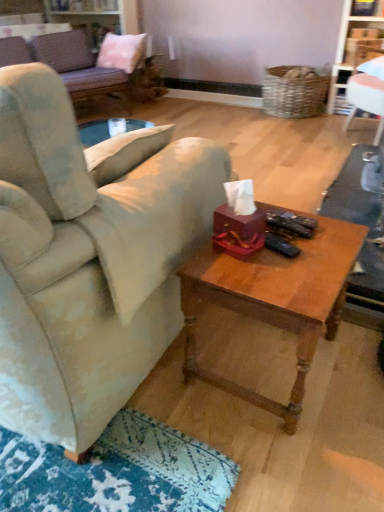
What is the approximate width of white glossy bookshelf at upper right?

It is 53.72 centimeters.

The width and height of the screenshot is (384, 512). Describe the element at coordinates (66, 62) in the screenshot. I see `velvet purple studio couch at upper left, acting as the first studio couch starting from the back` at that location.

The width and height of the screenshot is (384, 512). Describe the element at coordinates (273, 300) in the screenshot. I see `wooden coffee table at center` at that location.

What is the approximate width of velvet beige couch at center, the second studio couch when ordered from top to bottom?

4.13 feet.

The height and width of the screenshot is (512, 384). What do you see at coordinates (88, 260) in the screenshot?
I see `velvet beige couch at center, the second studio couch when ordered from top to bottom` at bounding box center [88, 260].

The height and width of the screenshot is (512, 384). What do you see at coordinates (121, 51) in the screenshot? I see `pink fabric pillow at upper left` at bounding box center [121, 51].

Identify the location of white glossy bookshelf at upper right. click(x=355, y=47).

Is wooden coffee table at center positioned far away from velvet purple studio couch at upper left, acting as the first studio couch starting from the back?

Indeed, wooden coffee table at center is not near velvet purple studio couch at upper left, acting as the first studio couch starting from the back.

Image resolution: width=384 pixels, height=512 pixels. In order to click on coffee table in front of the velvet purple studio couch at upper left, the 1th studio couch viewed from the top in this screenshot , I will do `click(273, 300)`.

Can you confirm if wooden coffee table at center is wider than velvet purple studio couch at upper left, arranged as the second studio couch when ordered from the bottom?

Incorrect, the width of wooden coffee table at center does not surpass that of velvet purple studio couch at upper left, arranged as the second studio couch when ordered from the bottom.

Is velvet purple studio couch at upper left, arranged as the second studio couch when ordered from the bottom, thinner than velvet beige couch at center, which is counted as the first studio couch, starting from the front?

Yes, velvet purple studio couch at upper left, arranged as the second studio couch when ordered from the bottom, is thinner than velvet beige couch at center, which is counted as the first studio couch, starting from the front.

Could you tell me if velvet purple studio couch at upper left, arranged as the second studio couch when ordered from the bottom, is turned towards velvet beige couch at center, positioned as the 2th studio couch in back-to-front order?

Yes, velvet purple studio couch at upper left, arranged as the second studio couch when ordered from the bottom, is oriented towards velvet beige couch at center, positioned as the 2th studio couch in back-to-front order.

Looking at this image, does velvet purple studio couch at upper left, the 1th studio couch viewed from the top, come behind velvet beige couch at center, which is counted as the first studio couch, starting from the front?

Yes, velvet purple studio couch at upper left, the 1th studio couch viewed from the top, is further from the viewer.

What's the angular difference between velvet purple studio couch at upper left, arranged as the second studio couch when viewed from the front, and white glossy bookshelf at upper right's facing directions?

velvet purple studio couch at upper left, arranged as the second studio couch when viewed from the front, and white glossy bookshelf at upper right are facing 118 degrees away from each other.

Which object is positioned more to the left, velvet purple studio couch at upper left, arranged as the second studio couch when ordered from the bottom, or white glossy bookshelf at upper right?

From the viewer's perspective, velvet purple studio couch at upper left, arranged as the second studio couch when ordered from the bottom, appears more on the left side.

Would you say velvet purple studio couch at upper left, acting as the first studio couch starting from the back, contains white glossy bookshelf at upper right?

No.

From the image's perspective, does velvet purple studio couch at upper left, arranged as the second studio couch when viewed from the front, appear higher than white glossy bookshelf at upper right?

Yes, from the image's perspective, velvet purple studio couch at upper left, arranged as the second studio couch when viewed from the front, is above white glossy bookshelf at upper right.

Can you confirm if velvet beige couch at center, the second studio couch when ordered from top to bottom, is positioned to the left of wooden coffee table at center?

Correct, you'll find velvet beige couch at center, the second studio couch when ordered from top to bottom, to the left of wooden coffee table at center.

Looking at this image, between velvet beige couch at center, the second studio couch when ordered from top to bottom, and wooden coffee table at center, which one has smaller width?

With smaller width is wooden coffee table at center.

Are velvet beige couch at center, which is counted as the first studio couch, starting from the front, and wooden coffee table at center far apart?

No, there isn't a large distance between velvet beige couch at center, which is counted as the first studio couch, starting from the front, and wooden coffee table at center.

From the image's perspective, is velvet beige couch at center, which is the 1th studio couch in bottom-to-top order, above pink fabric pillow at upper left?

Incorrect, from the image's perspective, velvet beige couch at center, which is the 1th studio couch in bottom-to-top order, is lower than pink fabric pillow at upper left.

Is velvet beige couch at center, the second studio couch when ordered from top to bottom, aimed at pink fabric pillow at upper left?

Yes, velvet beige couch at center, the second studio couch when ordered from top to bottom, is oriented towards pink fabric pillow at upper left.

Are velvet beige couch at center, positioned as the 2th studio couch in back-to-front order, and pink fabric pillow at upper left beside each other?

No, velvet beige couch at center, positioned as the 2th studio couch in back-to-front order, is not with pink fabric pillow at upper left.

How many degrees apart are the facing directions of velvet beige couch at center, positioned as the 2th studio couch in back-to-front order, and pink fabric pillow at upper left?

160 degrees.

Based on the photo, does white glossy bookshelf at upper right turn towards pink fabric pillow at upper left?

No, white glossy bookshelf at upper right is not oriented towards pink fabric pillow at upper left.

Can you confirm if white glossy bookshelf at upper right is positioned to the right of pink fabric pillow at upper left?

Yes.

What's the angular difference between white glossy bookshelf at upper right and pink fabric pillow at upper left's facing directions?

32.4 degrees.

Who is smaller, white glossy bookshelf at upper right or pink fabric pillow at upper left?

Smaller between the two is pink fabric pillow at upper left.

Is point (114, 340) closer or farther from the camera than point (79, 82)?

Point (114, 340) is closer to the camera than point (79, 82).

From the image's perspective, between velvet beige couch at center, the second studio couch when ordered from top to bottom, and velvet purple studio couch at upper left, the 1th studio couch viewed from the top, who is located below?

velvet beige couch at center, the second studio couch when ordered from top to bottom.

What's the angular difference between velvet beige couch at center, which is counted as the first studio couch, starting from the front, and velvet purple studio couch at upper left, acting as the first studio couch starting from the back,'s facing directions?

The angle between the facing direction of velvet beige couch at center, which is counted as the first studio couch, starting from the front, and the facing direction of velvet purple studio couch at upper left, acting as the first studio couch starting from the back, is 114 degrees.

Would you say velvet purple studio couch at upper left, acting as the first studio couch starting from the back, is part of velvet beige couch at center, which is the 1th studio couch in bottom-to-top order,'s contents?

No.

The height and width of the screenshot is (512, 384). What are the coordinates of `coffee table located underneath the velvet purple studio couch at upper left, acting as the first studio couch starting from the back (from a real-world perspective)` in the screenshot? It's located at (273, 300).

I want to click on studio couch that appears in front of the velvet purple studio couch at upper left, acting as the first studio couch starting from the back, so click(88, 260).

From the image, which object appears to be nearer to wooden coffee table at center, velvet beige couch at center, the second studio couch when ordered from top to bottom, or pink fabric pillow at upper left?

velvet beige couch at center, the second studio couch when ordered from top to bottom.

Estimate the real-world distances between objects in this image. Which object is further from white glossy bookshelf at upper right, velvet beige couch at center, which is counted as the first studio couch, starting from the front, or wooden coffee table at center?

velvet beige couch at center, which is counted as the first studio couch, starting from the front.

Estimate the real-world distances between objects in this image. Which object is further from pink fabric pillow at upper left, velvet beige couch at center, which is the 1th studio couch in bottom-to-top order, or velvet purple studio couch at upper left, arranged as the second studio couch when viewed from the front?

Among the two, velvet beige couch at center, which is the 1th studio couch in bottom-to-top order, is located further to pink fabric pillow at upper left.

Considering their positions, is white glossy bookshelf at upper right positioned further to velvet purple studio couch at upper left, acting as the first studio couch starting from the back, than pink fabric pillow at upper left?

The object further to velvet purple studio couch at upper left, acting as the first studio couch starting from the back, is white glossy bookshelf at upper right.

When comparing their distances from wooden coffee table at center, does velvet purple studio couch at upper left, acting as the first studio couch starting from the back, or pink fabric pillow at upper left seem further?

Among the two, pink fabric pillow at upper left is located further to wooden coffee table at center.

From the picture: Estimate the real-world distances between objects in this image. Which object is further from white glossy bookshelf at upper right, velvet purple studio couch at upper left, the 1th studio couch viewed from the top, or pink fabric pillow at upper left?

velvet purple studio couch at upper left, the 1th studio couch viewed from the top, lies further to white glossy bookshelf at upper right than the other object.

Considering their positions, is velvet beige couch at center, the second studio couch when ordered from top to bottom, positioned further to velvet purple studio couch at upper left, arranged as the second studio couch when ordered from the bottom, than wooden coffee table at center?

wooden coffee table at center lies further to velvet purple studio couch at upper left, arranged as the second studio couch when ordered from the bottom, than the other object.

Based on their spatial positions, is pink fabric pillow at upper left or white glossy bookshelf at upper right closer to velvet purple studio couch at upper left, arranged as the second studio couch when ordered from the bottom?

Based on the image, pink fabric pillow at upper left appears to be nearer to velvet purple studio couch at upper left, arranged as the second studio couch when ordered from the bottom.

You are a GUI agent. You are given a task and a screenshot of the screen. Output one action in this format:
    pyautogui.click(x=<x>, y=<y>)
    Task: Click on the studio couch between wooden coffee table at center and pink fabric pillow at upper left in the front-back direction
    
    Given the screenshot: What is the action you would take?
    pyautogui.click(x=66, y=62)

The image size is (384, 512). What are the coordinates of `bookshelf between velvet beige couch at center, which is the 1th studio couch in bottom-to-top order, and pink fabric pillow at upper left in the front-back direction` in the screenshot? It's located at (355, 47).

Where is `coffee table positioned between velvet beige couch at center, the second studio couch when ordered from top to bottom, and velvet purple studio couch at upper left, arranged as the second studio couch when viewed from the front, from near to far`? The height and width of the screenshot is (512, 384). coffee table positioned between velvet beige couch at center, the second studio couch when ordered from top to bottom, and velvet purple studio couch at upper left, arranged as the second studio couch when viewed from the front, from near to far is located at coordinates (273, 300).

Where is `studio couch between velvet beige couch at center, which is counted as the first studio couch, starting from the front, and pink fabric pillow at upper left in the front-back direction`? The image size is (384, 512). studio couch between velvet beige couch at center, which is counted as the first studio couch, starting from the front, and pink fabric pillow at upper left in the front-back direction is located at coordinates (66, 62).